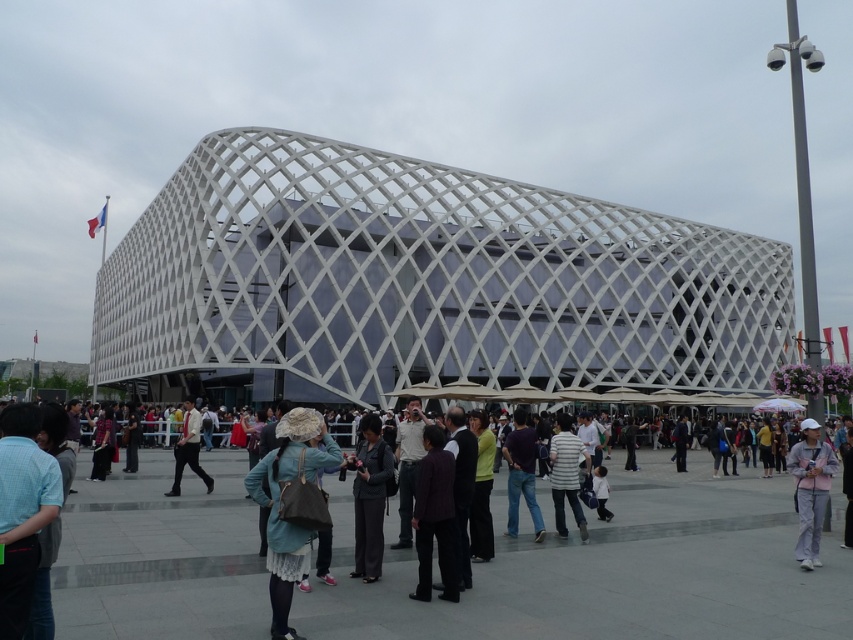
Question: Which of the following is the farthest from the observer?

Choices:
 (A) coord(99,552)
 (B) coord(355,497)
 (C) coord(344,220)

Answer: (C)

Question: Which point is farther to the camera?

Choices:
 (A) (44, 481)
 (B) (427, 554)
 (C) (563, 435)

Answer: (C)

Question: Which of these objects is positioned closest to the light blue shirt at lower left?

Choices:
 (A) striped cotton shirt at center
 (B) dark purple fabric jacket at center
 (C) dark gray suit at center

Answer: (C)

Question: Is dark purple fabric jacket at center further to the viewer compared to dark purple shirt at center?

Choices:
 (A) no
 (B) yes

Answer: (A)

Question: In this image, where is light blue shirt at lower left located relative to dark purple fabric jacket at center?

Choices:
 (A) above
 (B) below

Answer: (A)

Question: Observing the image, what is the correct spatial positioning of matte blue coat at center in reference to dark purple fabric jacket at center?

Choices:
 (A) right
 (B) left

Answer: (B)